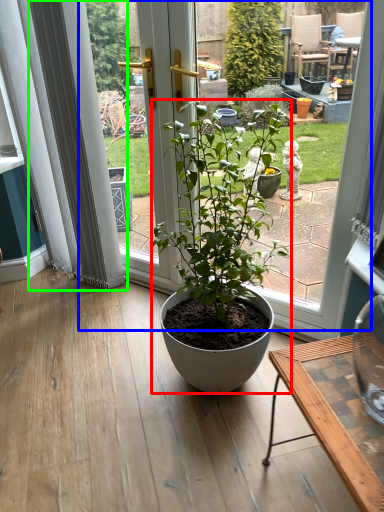
Question: Which object is positioned farthest from houseplant (highlighted by a red box)? Select from bay window (highlighted by a blue box) and curtain (highlighted by a green box).

Choices:
 (A) bay window
 (B) curtain

Answer: (B)